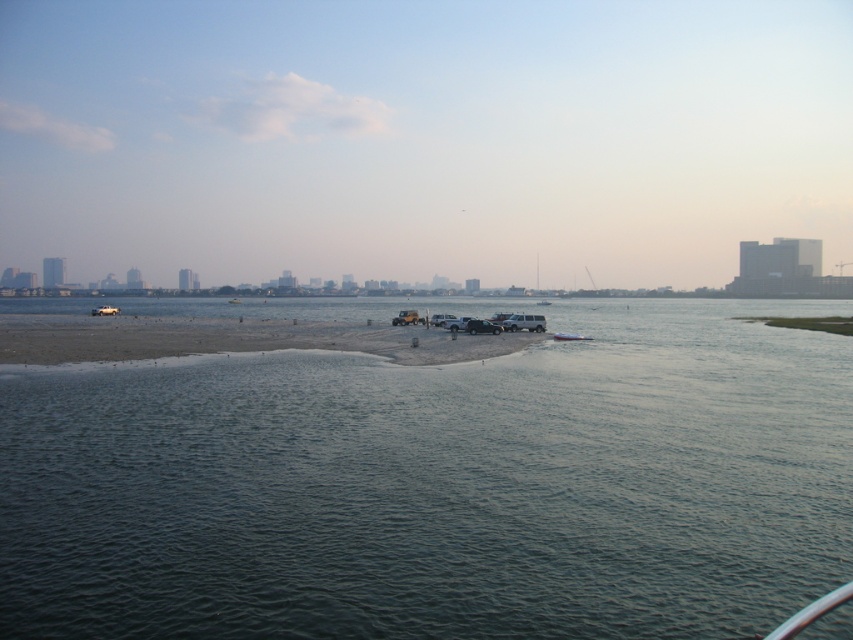
Which is more to the right, greenish-blue water at center or brown sandy beach at center?

greenish-blue water at center is more to the right.

Between greenish-blue water at center and brown sandy beach at center, which one has more height?

With more height is greenish-blue water at center.

Locate an element on the screen. This screenshot has width=853, height=640. greenish-blue water at center is located at coordinates (439, 484).

Does greenish-blue water at center have a larger size compared to metallic silver boat at center?

Correct, greenish-blue water at center is larger in size than metallic silver boat at center.

Who is higher up, greenish-blue water at center or metallic silver boat at center?

greenish-blue water at center is higher up.

Does point (213, 621) come behind point (572, 333)?

No, it is not.

Where is `greenish-blue water at center`? greenish-blue water at center is located at coordinates (439, 484).

Is brown sandy beach at center bigger than metallic silver boat at center?

Yes.

Can you confirm if brown sandy beach at center is thinner than metallic silver boat at center?

No, brown sandy beach at center is not thinner than metallic silver boat at center.

Describe the element at coordinates (230, 339) in the screenshot. I see `brown sandy beach at center` at that location.

At what (x,y) coordinates should I click in order to perform the action: click on brown sandy beach at center. Please return your answer as a coordinate pair (x, y). The height and width of the screenshot is (640, 853). Looking at the image, I should click on (230, 339).